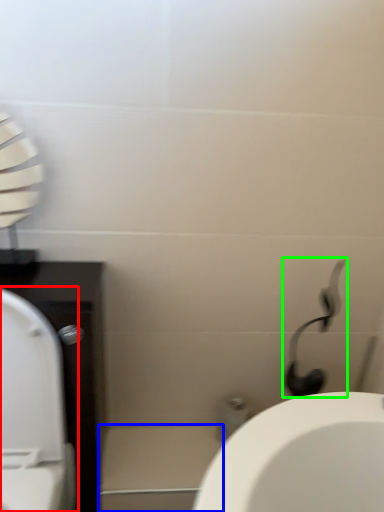
Question: Based on their relative distances, which object is nearer to toilet (highlighted by a red box)? Choose from porcelain (highlighted by a blue box) and shower (highlighted by a green box).

Choices:
 (A) porcelain
 (B) shower

Answer: (A)